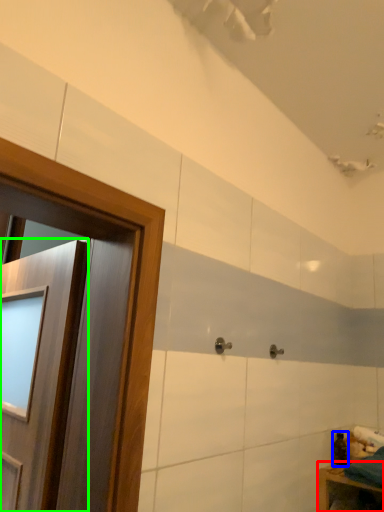
Question: Based on their relative distances, which object is farther from furniture (highlighted by a red box)? Choose from toiletry (highlighted by a blue box) and door (highlighted by a green box).

Choices:
 (A) toiletry
 (B) door

Answer: (B)